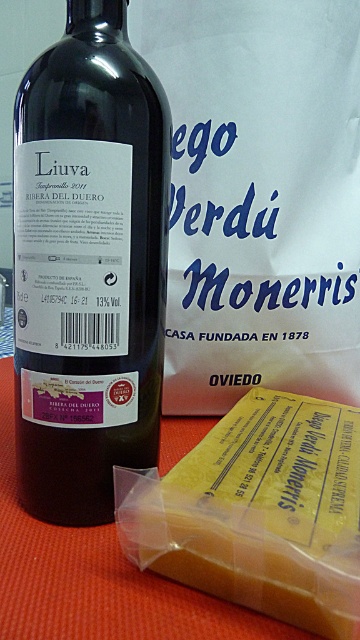
Question: Where is green glass bottle at center located in relation to yellow cheese at lower right in the image?

Choices:
 (A) above
 (B) below

Answer: (A)

Question: Is white paper at upper center to the right of green glass bottle at center from the viewer's perspective?

Choices:
 (A) no
 (B) yes

Answer: (B)

Question: Which object appears closest to the camera in this image?

Choices:
 (A) yellow cheese at lower right
 (B) white paper at upper center
 (C) green glass bottle at center

Answer: (A)

Question: Which point is farther from the camera taking this photo?

Choices:
 (A) (347, 454)
 (B) (264, 225)

Answer: (B)

Question: Is white paper at upper center to the left of green glass bottle at center from the viewer's perspective?

Choices:
 (A) no
 (B) yes

Answer: (A)

Question: Which object is closer to the camera taking this photo?

Choices:
 (A) white paper at upper center
 (B) green glass bottle at center
 (C) yellow cheese at lower right

Answer: (C)